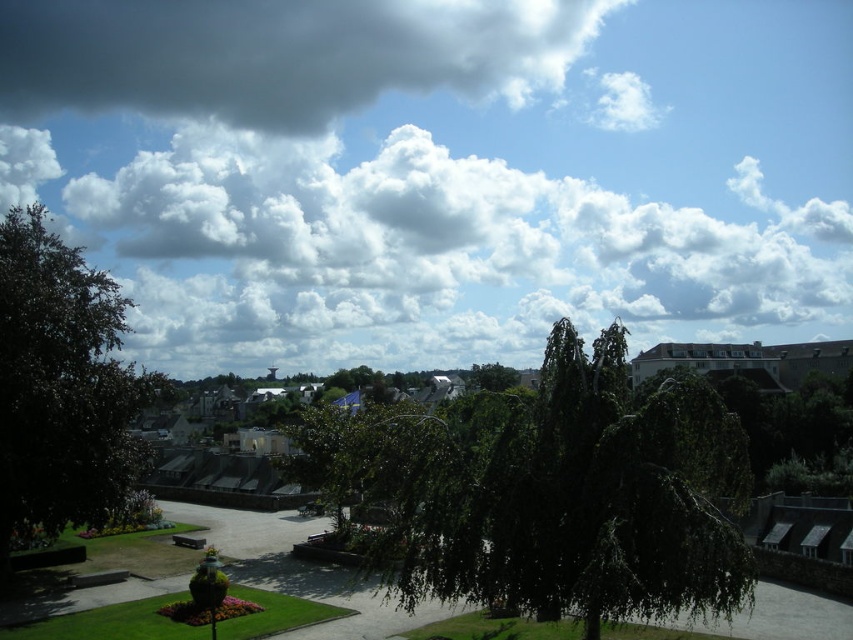
Does dark green leafy tree at center appear on the right side of dark gray fluffy cloud at upper center?

Correct, you'll find dark green leafy tree at center to the right of dark gray fluffy cloud at upper center.

Consider the image. Between dark green leafy tree at center and dark gray fluffy cloud at upper center, which one appears on the left side from the viewer's perspective?

dark gray fluffy cloud at upper center

Is point (666, 490) less distant than point (35, 42)?

That is True.

Find the location of a particular element. The image size is (853, 640). dark green leafy tree at center is located at coordinates (x=575, y=497).

Is dark green leafy tree at center positioned before green leafy tree at left?

That is True.

Does dark green leafy tree at center appear over green leafy tree at left?

Actually, dark green leafy tree at center is below green leafy tree at left.

Who is more forward, (563, 577) or (115, 371)?

Point (563, 577) is more forward.

What are the coordinates of `dark green leafy tree at center` in the screenshot? It's located at (575, 497).

Can you confirm if dark gray fluffy cloud at upper center is positioned to the left of green leafy tree at left?

Correct, you'll find dark gray fluffy cloud at upper center to the left of green leafy tree at left.

Can you confirm if dark gray fluffy cloud at upper center is thinner than green leafy tree at left?

Incorrect, dark gray fluffy cloud at upper center's width is not less than green leafy tree at left's.

Who is more forward, (219, 16) or (74, 294)?

Point (74, 294) is in front.

Locate an element on the screen. This screenshot has height=640, width=853. dark gray fluffy cloud at upper center is located at coordinates (x=279, y=54).